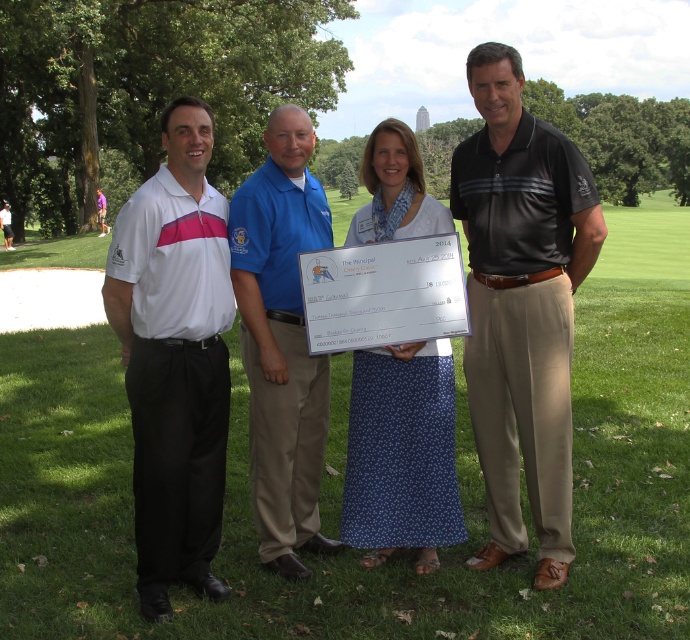
Which is more to the right, white smooth polo shirt at left or blue smooth shirt at center?

Positioned to the right is blue smooth shirt at center.

Which is behind, point (199, 358) or point (282, 340)?

Point (282, 340)

Identify the location of white smooth polo shirt at left. This screenshot has height=640, width=690. (175, 356).

Consider the image. Can you confirm if blue smooth shirt at center is taller than blue floral skirt at center?

Indeed, blue smooth shirt at center has a greater height compared to blue floral skirt at center.

Is blue smooth shirt at center to the right of blue floral skirt at center from the viewer's perspective?

In fact, blue smooth shirt at center is to the left of blue floral skirt at center.

Which is behind, point (276, 548) or point (348, 522)?

Point (348, 522)

The image size is (690, 640). I want to click on blue smooth shirt at center, so click(282, 340).

Does dark gray striped polo shirt at center lie in front of blue floral skirt at center?

Yes, it is.

Between point (466, 195) and point (393, 413), which one is positioned in front?

Point (466, 195) is more forward.

Identify the location of dark gray striped polo shirt at center. This screenshot has width=690, height=640. (522, 307).